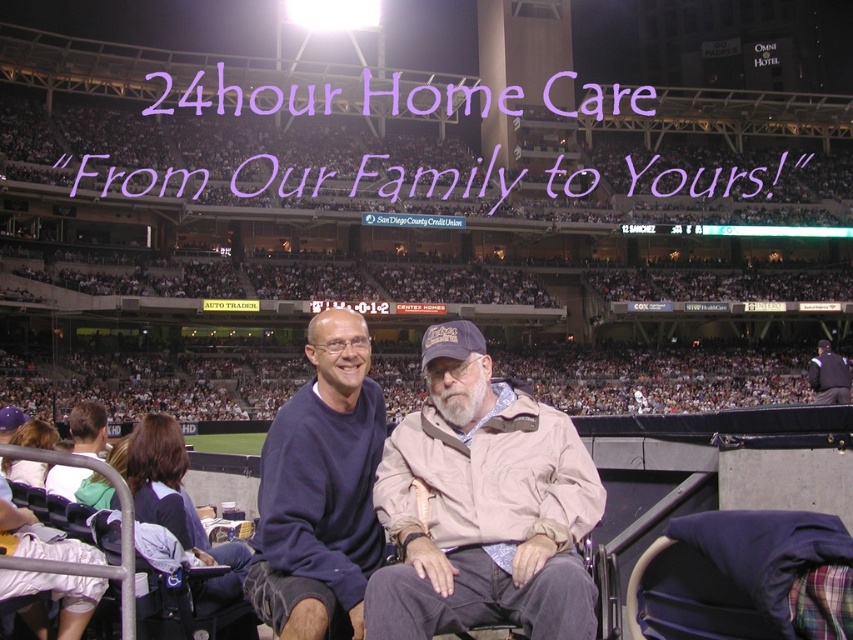
Question: Which object appears farthest from the camera in this image?

Choices:
 (A) dark blue uniform at center
 (B) beige fabric jacket at center
 (C) light blue shirt at lower left
 (D) navy blue sweatshirt at center

Answer: (A)

Question: Which point is farther from the camera taking this photo?

Choices:
 (A) (497, 604)
 (B) (102, 417)
 (C) (846, 376)
 (D) (323, 419)

Answer: (C)

Question: Can you confirm if light blue shirt at lower left is thinner than dark blue uniform at center?

Choices:
 (A) yes
 (B) no

Answer: (A)

Question: Which point appears closest to the camera in this image?

Choices:
 (A) (323, 484)
 (B) (90, 417)
 (C) (521, 548)
 (D) (815, 392)

Answer: (C)

Question: Is beige fabric jacket at center below dark blue uniform at center?

Choices:
 (A) no
 (B) yes

Answer: (A)

Question: Does navy blue sweatshirt at center have a larger size compared to dark blue uniform at center?

Choices:
 (A) no
 (B) yes

Answer: (A)